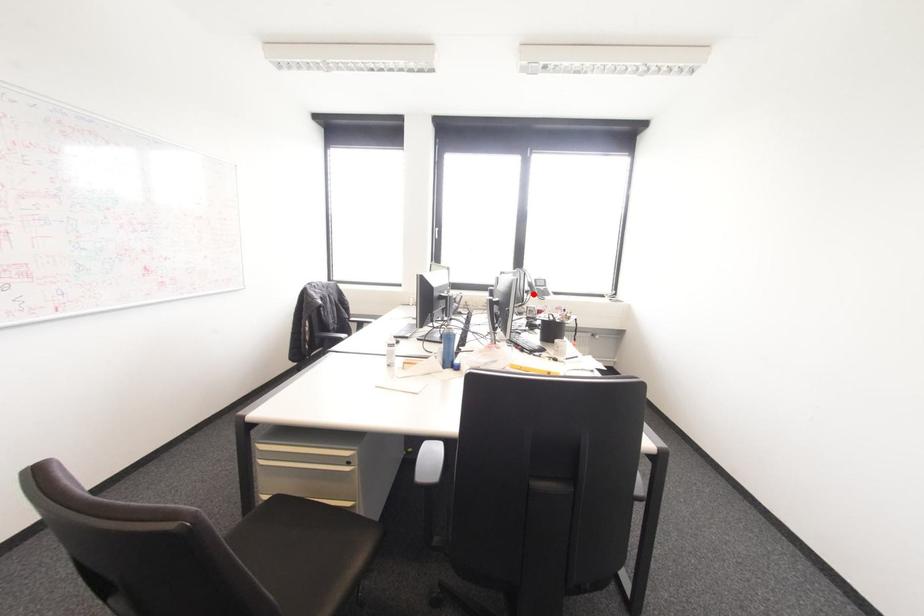
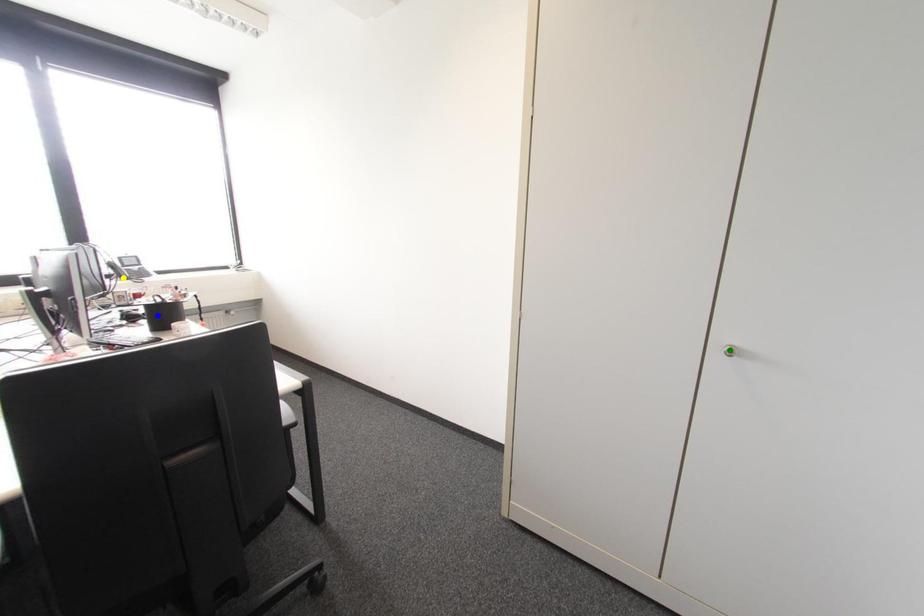
Question: I am providing you with two images of the same scene from different viewpoints. A red point is marked on the first image. You are given multiple points on the second image. Which point in image 2 is actually the same real-world point as the red point in image 1?

Choices:
 (A) green point
 (B) yellow point
 (C) blue point

Answer: (B)